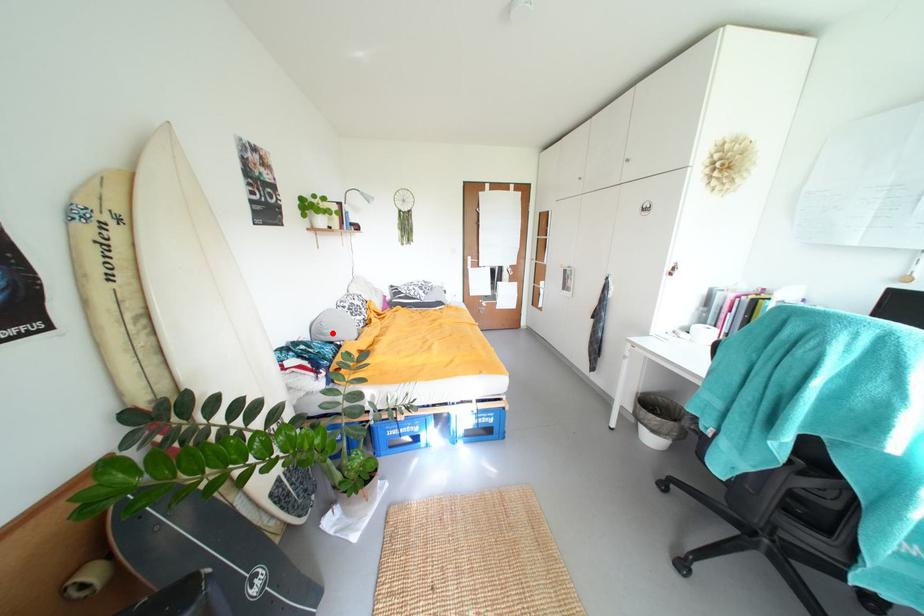
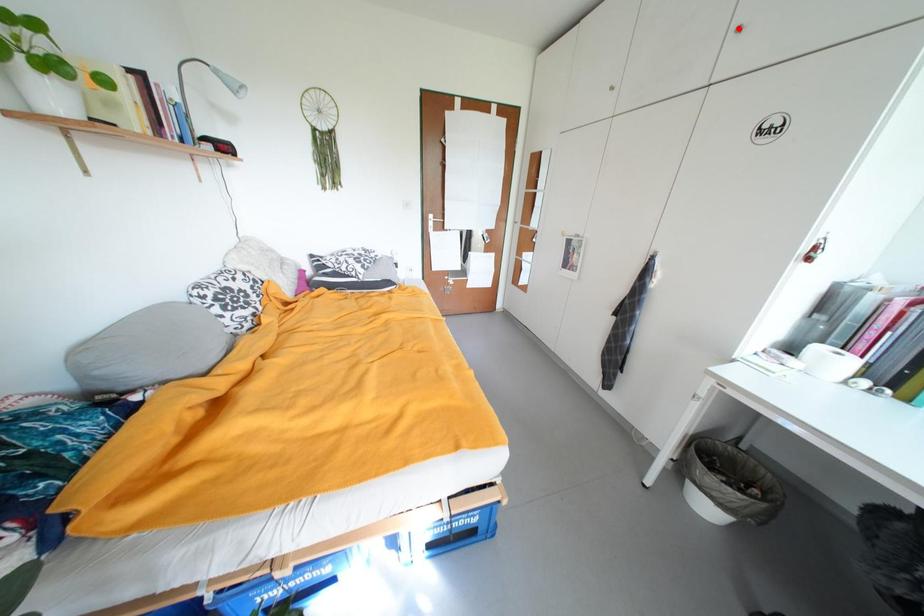
I am providing you with two images of the same scene from different viewpoints. A red point is marked on the first image and another point is marked on the second image. Is the marked point in image1 the same physical position as the marked point in image2?

No